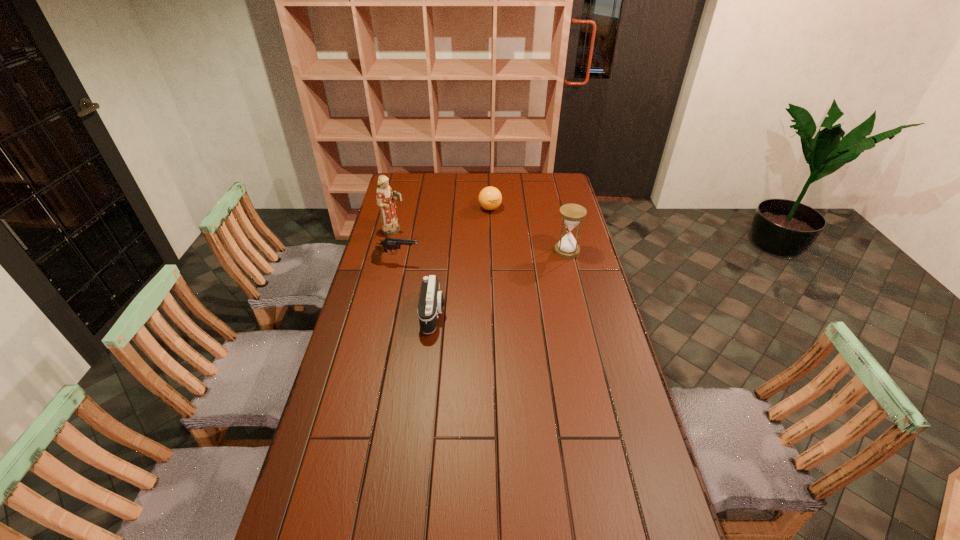
Where is `vacant space that satisfies the following two spatial constraints: 1. on the front side of the tallest object; 2. on the left side of the second nearest object`? The width and height of the screenshot is (960, 540). vacant space that satisfies the following two spatial constraints: 1. on the front side of the tallest object; 2. on the left side of the second nearest object is located at coordinates (387, 262).

Where is `blank space that satisfies the following two spatial constraints: 1. on the back side of the farthest object; 2. on the left side of the tallest object`? blank space that satisfies the following two spatial constraints: 1. on the back side of the farthest object; 2. on the left side of the tallest object is located at coordinates (400, 208).

Where is `vacant space that satisfies the following two spatial constraints: 1. on the back side of the hourglass; 2. on the left side of the gun`? vacant space that satisfies the following two spatial constraints: 1. on the back side of the hourglass; 2. on the left side of the gun is located at coordinates (398, 251).

At what (x,y) coordinates should I click in order to perform the action: click on free location that satisfies the following two spatial constraints: 1. on the front side of the tallest object; 2. on the front lens of the camera. Please return your answer as a coordinate pair (x, y). The image size is (960, 540). Looking at the image, I should click on (373, 314).

What are the coordinates of `free space that satisfies the following two spatial constraints: 1. on the front side of the tallest object; 2. on the right side of the second nearest object` in the screenshot? It's located at (387, 262).